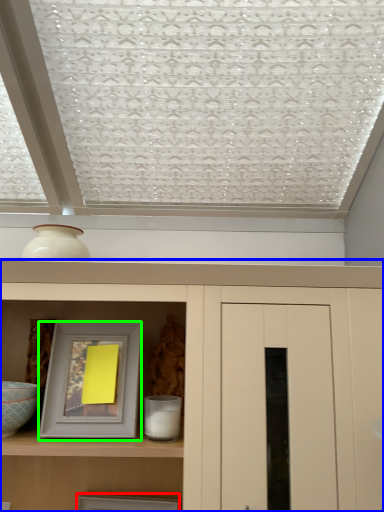
Question: Based on their relative distances, which object is nearer to picture frame (highlighted by a red box)? Choose from cupboard (highlighted by a blue box) and picture frame (highlighted by a green box).

Choices:
 (A) cupboard
 (B) picture frame

Answer: (B)